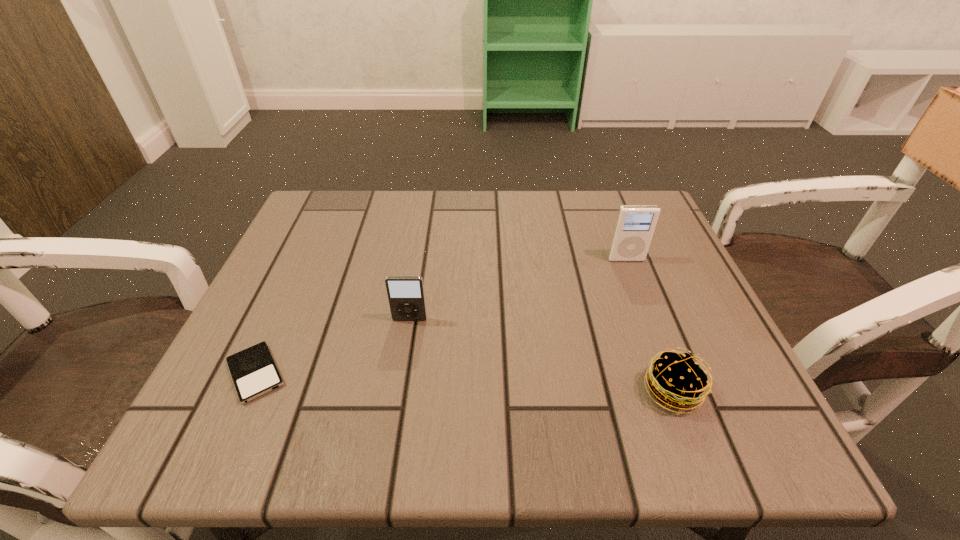
At what (x,y) coordinates should I click in order to perform the action: click on free space located on the front of the shortest iPod. Please return your answer as a coordinate pair (x, y). This screenshot has width=960, height=540. Looking at the image, I should click on (222, 449).

I want to click on patty located at the near edge, so click(676, 380).

Identify the location of iPod positioned at the near edge. This screenshot has height=540, width=960. (254, 372).

The height and width of the screenshot is (540, 960). I want to click on object present at the left edge, so click(x=254, y=372).

Locate an element on the screen. This screenshot has width=960, height=540. iPod located at the right edge is located at coordinates (635, 224).

The height and width of the screenshot is (540, 960). What are the coordinates of `patty that is positioned at the right edge` in the screenshot? It's located at (676, 380).

Locate an element on the screen. object present at the near left corner is located at coordinates (254, 372).

Locate an element on the screen. This screenshot has height=540, width=960. object that is at the near right corner is located at coordinates (676, 380).

In the image, there is a desktop. Where is `vacant region at the far edge`? vacant region at the far edge is located at coordinates (491, 213).

Find the location of a particular element. The height and width of the screenshot is (540, 960). free location at the near edge is located at coordinates (496, 437).